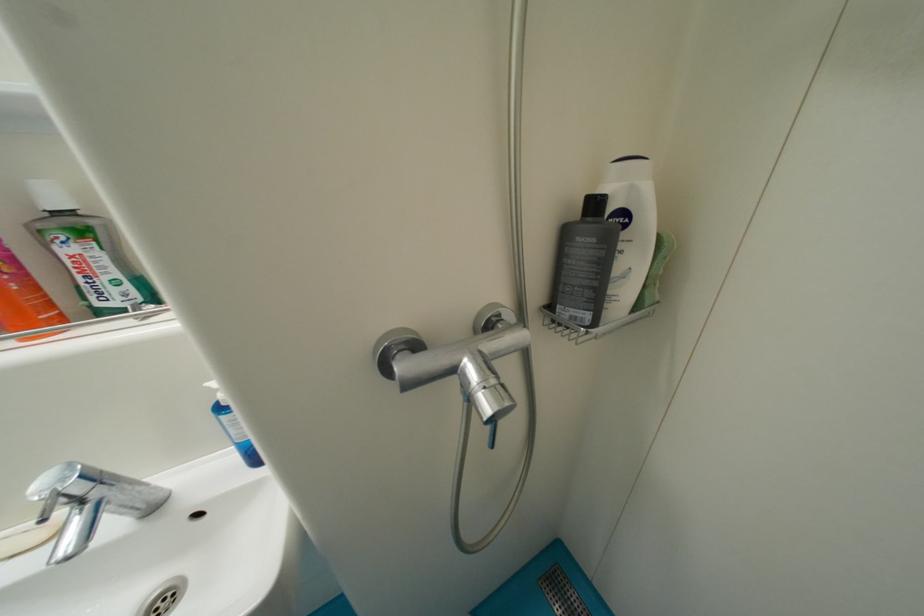
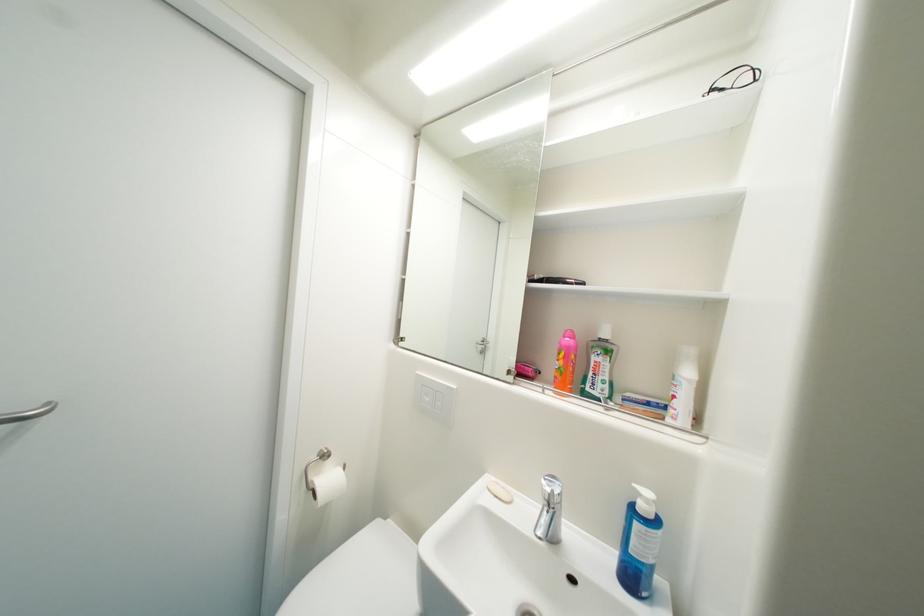
Question: The camera is either moving clockwise (left) or counter-clockwise (right) around the object. The first image is from the beginning of the video and the second image is from the end. Is the camera moving left or right when shooting the video?

Choices:
 (A) Left
 (B) Right

Answer: (B)